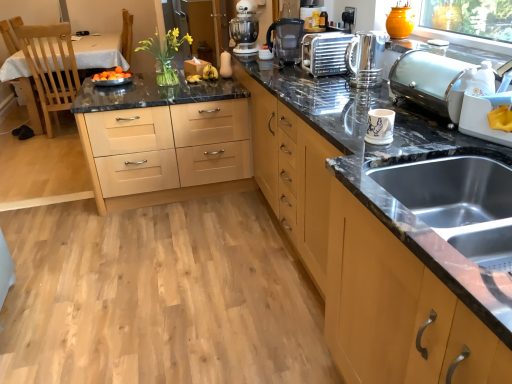
Locate an element on the screen. The height and width of the screenshot is (384, 512). white matte stand mixer at center is located at coordinates (244, 29).

In order to click on shiny metallic kettle at upper right in this screenshot , I will do `click(366, 59)`.

Find the location of a particular element. The height and width of the screenshot is (384, 512). matte brown cabinet at lower right is located at coordinates (x=397, y=309).

What do you see at coordinates (397, 309) in the screenshot? The height and width of the screenshot is (384, 512). I see `matte brown cabinet at lower right` at bounding box center [397, 309].

What do you see at coordinates (99, 52) in the screenshot? I see `wooden table at left` at bounding box center [99, 52].

Where is `white matte stand mixer at center`? This screenshot has width=512, height=384. white matte stand mixer at center is located at coordinates pos(244,29).

Looking at this image, are wooden table at left and satin silver toaster at upper center, placed as the 3th appliance when sorted from front to back, making contact?

No, wooden table at left is not beside satin silver toaster at upper center, placed as the 3th appliance when sorted from front to back.

Considering the relative positions of wooden table at left and satin silver toaster at upper center, the 1th appliance when ordered from back to front, in the image provided, is wooden table at left to the left of satin silver toaster at upper center, the 1th appliance when ordered from back to front, from the viewer's perspective?

Indeed, wooden table at left is positioned on the left side of satin silver toaster at upper center, the 1th appliance when ordered from back to front.

From a real-world perspective, is wooden table at left beneath satin silver toaster at upper center, placed as the 3th appliance when sorted from front to back?

Indeed, from a real-world perspective, wooden table at left is positioned beneath satin silver toaster at upper center, placed as the 3th appliance when sorted from front to back.

Does black plastic coffee machine at center turn towards satin silver toaster at upper center, placed as the 3th appliance when sorted from front to back?

No.

From the image's perspective, starting from the black plastic coffee machine at center, which appliance is the 1st one below? Please provide its 2D coordinates.

[(324, 53)]

Does black plastic coffee machine at center have a greater height compared to satin silver toaster at upper center, arranged as the 1th appliance when viewed from the left?

Yes.

From a real-world perspective, is black plastic coffee machine at center physically located above or below satin silver toaster at upper center, placed as the 3th appliance when sorted from front to back?

From a real-world perspective, black plastic coffee machine at center is physically above satin silver toaster at upper center, placed as the 3th appliance when sorted from front to back.

Which is correct: satin silver toaster at upper right, marked as the third appliance in a left-to-right arrangement, is inside matte wood chest of drawers at center, or outside of it?

satin silver toaster at upper right, marked as the third appliance in a left-to-right arrangement, exists outside the volume of matte wood chest of drawers at center.

Is satin silver toaster at upper right, the 2th appliance in the back-to-front sequence, further to camera compared to matte wood chest of drawers at center?

No, the depth of satin silver toaster at upper right, the 2th appliance in the back-to-front sequence, is less than that of matte wood chest of drawers at center.

Is satin silver toaster at upper right, which is the 1th appliance in right-to-left order, oriented away from matte wood chest of drawers at center?

No, satin silver toaster at upper right, which is the 1th appliance in right-to-left order,'s orientation is not away from matte wood chest of drawers at center.

Is point (247, 115) in front of point (114, 57)?

Yes, it is.

The height and width of the screenshot is (384, 512). Find the location of `table that is above the matte wood chest of drawers at center (from a real-world perspective)`. table that is above the matte wood chest of drawers at center (from a real-world perspective) is located at coordinates (99, 52).

Consider the image. Between matte wood chest of drawers at center and wooden table at left, which one appears on the right side from the viewer's perspective?

matte wood chest of drawers at center is more to the right.

From the image's perspective, is black plastic coffee machine at center under matte brown cabinet at lower right?

No.

Measure the distance between black plastic coffee machine at center and matte brown cabinet at lower right.

black plastic coffee machine at center and matte brown cabinet at lower right are 1.79 meters apart from each other.

Which object is closer to the camera taking this photo, black plastic coffee machine at center or matte brown cabinet at lower right?

matte brown cabinet at lower right.

How many degrees apart are the facing directions of black plastic coffee machine at center and matte brown cabinet at lower right?

3.63 degrees separate the facing orientations of black plastic coffee machine at center and matte brown cabinet at lower right.

Does matte wood chest of drawers at center have a smaller size compared to matte brown cabinet at lower right?

Incorrect, matte wood chest of drawers at center is not smaller in size than matte brown cabinet at lower right.

Consider the image. Between matte wood chest of drawers at center and matte brown cabinet at lower right, which one is positioned behind?

Positioned behind is matte wood chest of drawers at center.

From the image's perspective, is matte wood chest of drawers at center beneath matte brown cabinet at lower right?

No.

From the picture: Which is more to the left, matte wood chest of drawers at center or matte brown cabinet at lower right?

From the viewer's perspective, matte wood chest of drawers at center appears more on the left side.

Are matte wood chest of drawers at center and white matte stand mixer at center beside each other?

matte wood chest of drawers at center is not next to white matte stand mixer at center, and they're not touching.

Considering the sizes of matte wood chest of drawers at center and white matte stand mixer at center in the image, is matte wood chest of drawers at center bigger or smaller than white matte stand mixer at center?

matte wood chest of drawers at center is bigger than white matte stand mixer at center.

From the image's perspective, starting from the wooden table at left, which appliance is the 1st one below? Please provide its 2D coordinates.

[(324, 53)]

Image resolution: width=512 pixels, height=384 pixels. Identify the location of coffee machine behind the satin silver toaster at upper center, arranged as the 1th appliance when viewed from the left. (286, 40).

Estimate the real-world distances between objects in this image. Which object is closer to wooden table at left, shiny metallic kettle at upper right or matte wood chest of drawers at center?

matte wood chest of drawers at center.

Which object lies further to the anchor point wooden table at left, satin silver toaster at upper center, the 1th appliance when ordered from back to front, or shiny metallic kettle at upper right?

shiny metallic kettle at upper right lies further to wooden table at left than the other object.

When comparing their distances from shiny metallic kettle at upper right, does satin silver toaster at upper right, which is the 1th appliance in right-to-left order, or satin silver toaster at upper center, arranged as the 1th appliance when viewed from the left, seem closer?

satin silver toaster at upper center, arranged as the 1th appliance when viewed from the left, lies closer to shiny metallic kettle at upper right than the other object.

From the image, which object appears to be farther from white matte stand mixer at center, shiny metallic kettle at upper right or matte brown cabinet at lower right?

Among the two, matte brown cabinet at lower right is located further to white matte stand mixer at center.

Which object lies nearer to the anchor point matte wood chest of drawers at center, satin silver toaster at upper right, which is the 1th appliance in right-to-left order, or wooden table at left?

Among the two, satin silver toaster at upper right, which is the 1th appliance in right-to-left order, is located nearer to matte wood chest of drawers at center.

Based on their spatial positions, is wooden table at left or satin silver toaster at upper center, which is the 3th appliance in bottom-to-top order, further from black plastic coffee machine at center?

wooden table at left is further to black plastic coffee machine at center.

When comparing their distances from matte brown cabinet at lower right, does shiny metallic kettle at upper right or satin silver toaster at upper center, the 3th appliance viewed from the right, seem further?

satin silver toaster at upper center, the 3th appliance viewed from the right.

When comparing their distances from shiny metallic kettle at upper right, does wooden table at left or matte wood chest of drawers at center seem further?

wooden table at left.

Where is `the chest of drawers situated between wooden table at left and shiny metallic kettle at upper right from left to right`? This screenshot has width=512, height=384. the chest of drawers situated between wooden table at left and shiny metallic kettle at upper right from left to right is located at coordinates coord(162,135).

Image resolution: width=512 pixels, height=384 pixels. In order to click on kitchen appliance located between white ceramic mug at upper right, the third appliance in the top-to-bottom sequence, and satin silver toaster at upper center, placed as the 3th appliance when sorted from front to back, in the depth direction in this screenshot , I will do `click(366, 59)`.

I want to click on kitchen appliance between white ceramic mug at upper right, the first appliance from the front, and white matte stand mixer at center, along the z-axis, so click(366, 59).

What are the coordinates of `coffee machine between wooden table at left and shiny metallic kettle at upper right from left to right` in the screenshot? It's located at (286, 40).